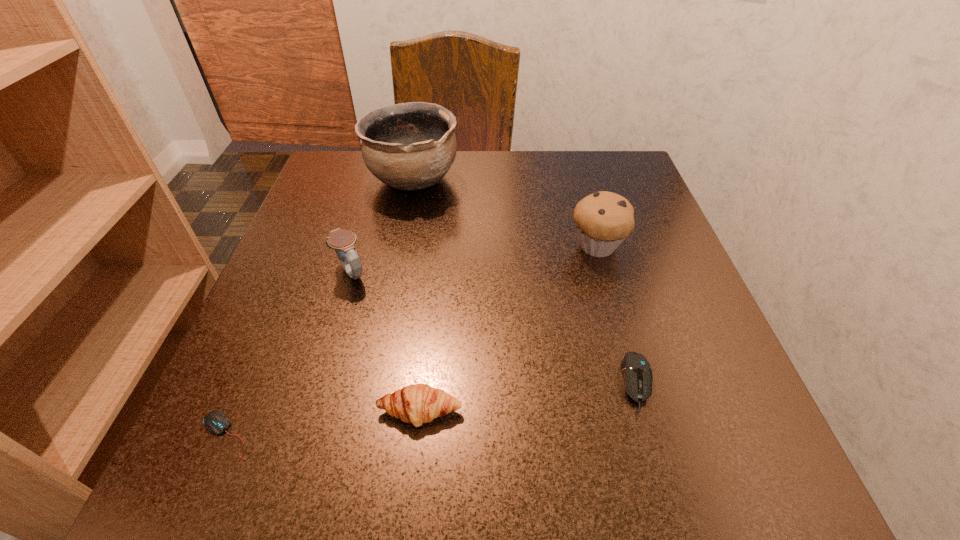
Identify which object is the third nearest to the taller mouse. Please provide its 2D coordinates. Your answer should be formatted as a tuple, i.e. [(x, y)], where the tuple contains the x and y coordinates of a point satisfying the conditions above.

[(342, 241)]

Locate which object is the closest to the tallest object. Please provide its 2D coordinates. Your answer should be formatted as a tuple, i.e. [(x, y)], where the tuple contains the x and y coordinates of a point satisfying the conditions above.

[(342, 241)]